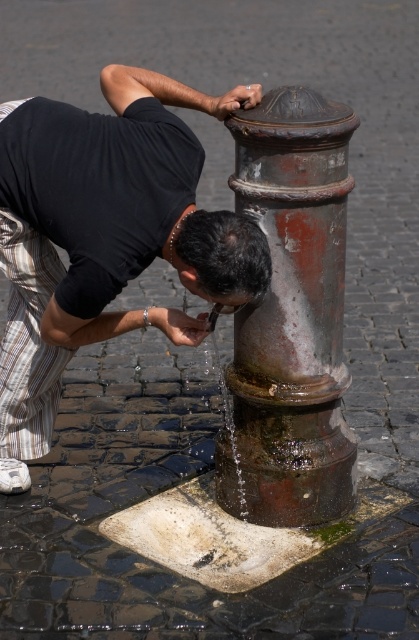
Between matte black shirt at left and rusty metal hydrant at center, which one has less height?

rusty metal hydrant at center is shorter.

Does point (113, 280) come behind point (325, 474)?

No, (113, 280) is in front of (325, 474).

Identify the location of matte black shirt at left. (105, 236).